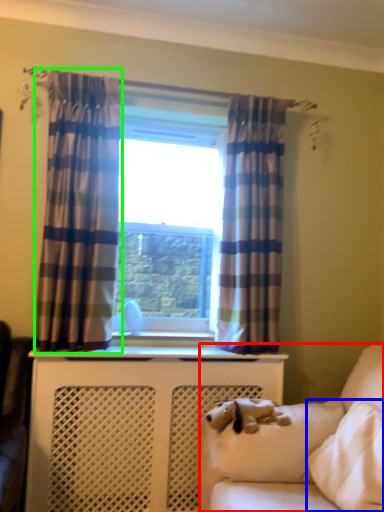
Question: Which object is the farthest from studio couch (highlighted by a red box)? Choose among these: pillow (highlighted by a blue box) or curtain (highlighted by a green box).

Choices:
 (A) pillow
 (B) curtain

Answer: (B)